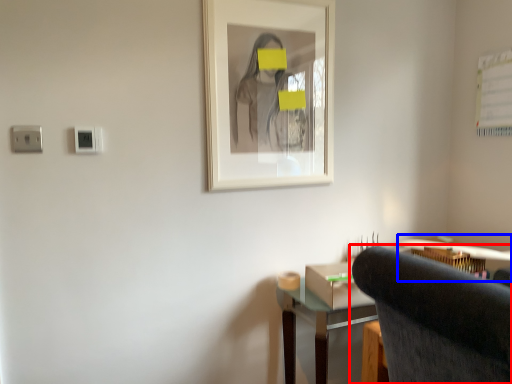
Question: Which object appears closest to the camera in this image, chair (highlighted by a red box) or computer desk (highlighted by a blue box)?

Choices:
 (A) chair
 (B) computer desk

Answer: (A)